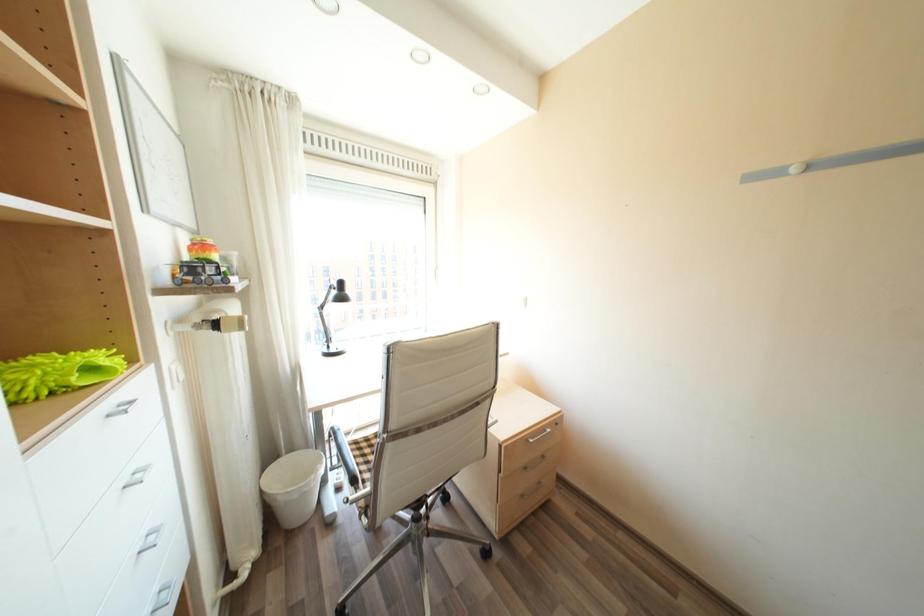
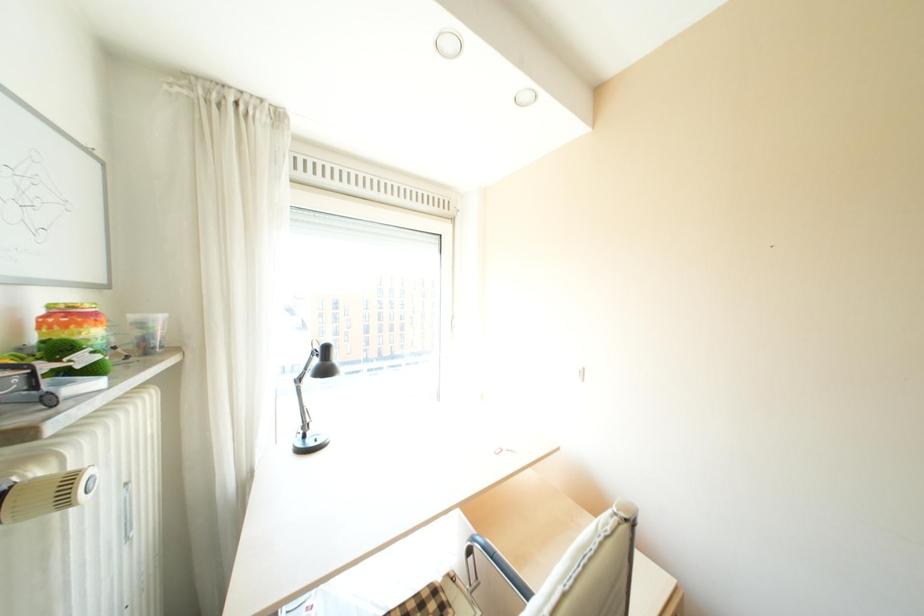
Question: How did the camera likely rotate?

Choices:
 (A) Left
 (B) Right
 (C) Up
 (D) Down

Answer: (C)